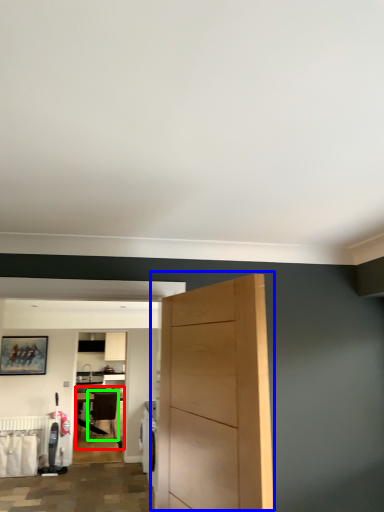
Question: Estimate the real-world distances between objects in this image. Which object is farther from table (highlighted by a red box), door (highlighted by a blue box) or chair (highlighted by a green box)?

Choices:
 (A) door
 (B) chair

Answer: (A)